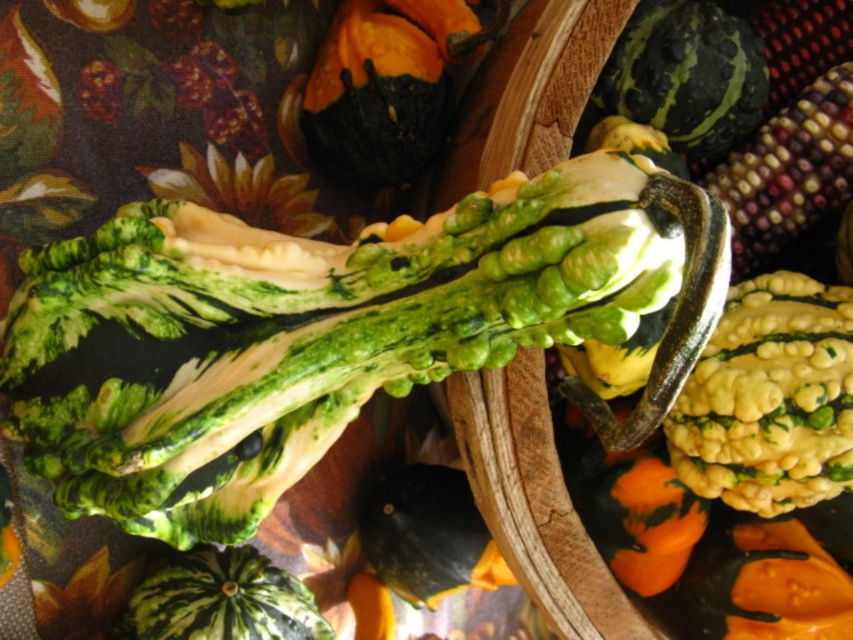
Question: In this image, where is dark green textured gourd at upper center located relative to multicolored glossy corn at upper right?

Choices:
 (A) left
 (B) right

Answer: (A)

Question: Which of the following is the farthest from the observer?

Choices:
 (A) dark green textured gourd at upper center
 (B) multicolored glossy corn at upper right

Answer: (B)

Question: Which point is farther to the camera?

Choices:
 (A) (837, 150)
 (B) (323, 154)

Answer: (B)

Question: Is dark green textured gourd at upper center positioned before multicolored glossy corn at upper right?

Choices:
 (A) no
 (B) yes

Answer: (B)

Question: Is dark green textured gourd at upper center above multicolored glossy corn at upper right?

Choices:
 (A) no
 (B) yes

Answer: (B)